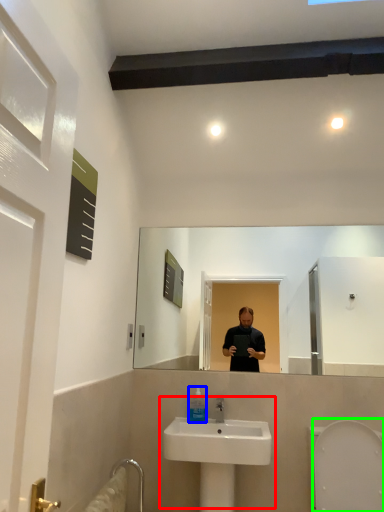
Question: Which object is positioned farthest from sink (highlighted by a red box)? Select from mouthwash (highlighted by a blue box) and bidet (highlighted by a green box).

Choices:
 (A) mouthwash
 (B) bidet

Answer: (B)